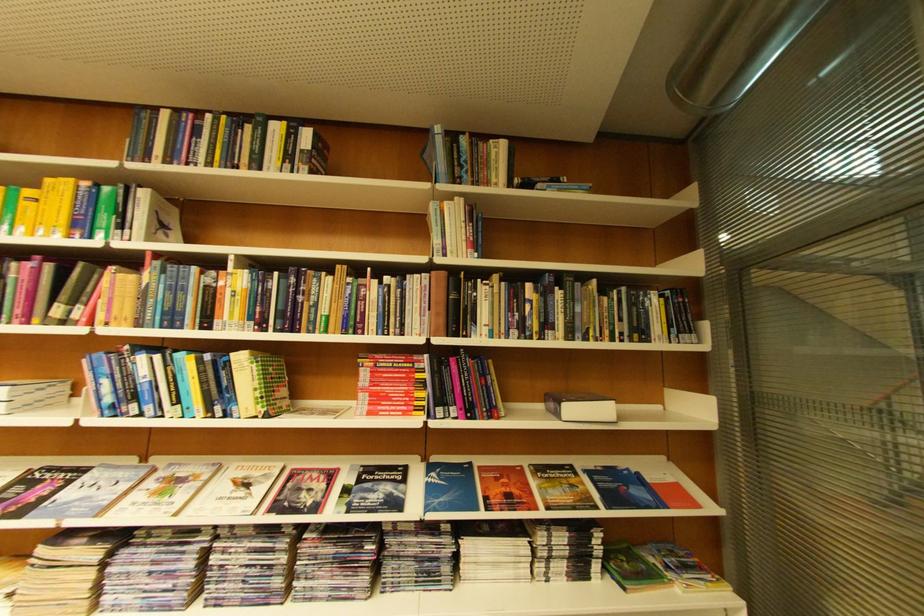
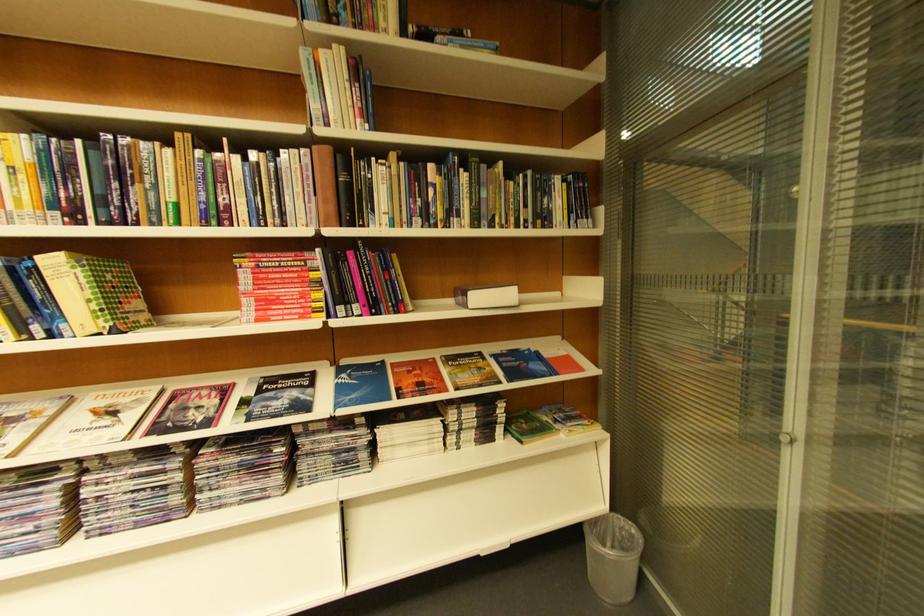
Find the pixel in the second image that matches pixel 651 333 in the first image.

(554, 221)